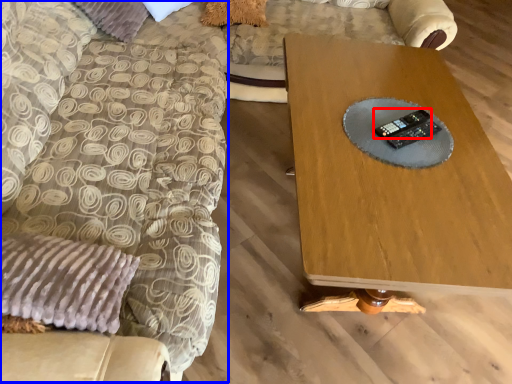
Question: Which object appears closest to the camera in this image, control (highlighted by a red box) or swivel chair (highlighted by a blue box)?

Choices:
 (A) control
 (B) swivel chair

Answer: (B)